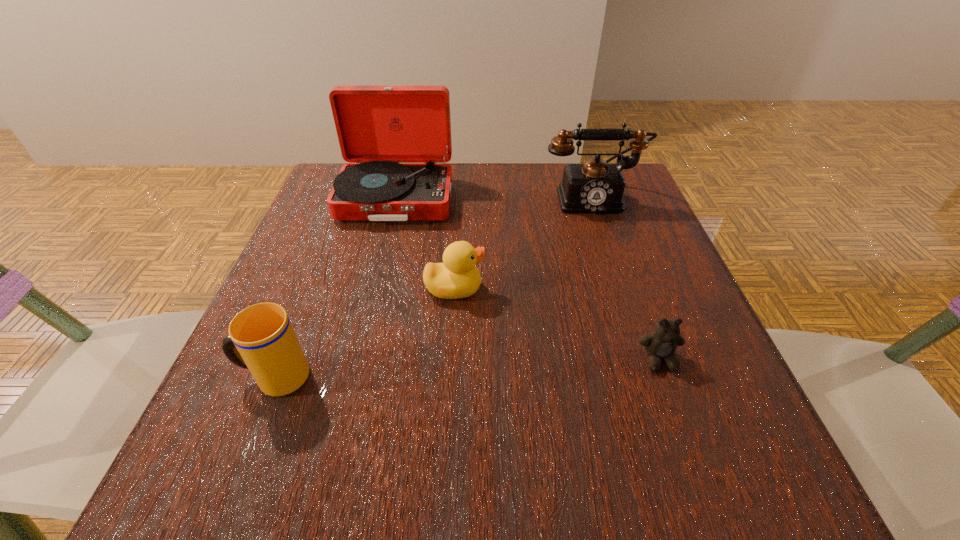
Find the location of a particular element. The height and width of the screenshot is (540, 960). empty space between the fourth shortest object and the third farthest object is located at coordinates (523, 244).

The width and height of the screenshot is (960, 540). What are the coordinates of `free space that is in between the tallest object and the telephone` in the screenshot? It's located at (493, 199).

This screenshot has width=960, height=540. What are the coordinates of `the closest object to the third nearest object` in the screenshot? It's located at (397, 139).

Identify which object is located as the third nearest to the second shortest object. Please provide its 2D coordinates. Your answer should be formatted as a tuple, i.e. [(x, y)], where the tuple contains the x and y coordinates of a point satisfying the conditions above.

[(593, 187)]

This screenshot has height=540, width=960. Find the location of `free spot that satisfies the following two spatial constraints: 1. on the front of the telephone at the rotary dial; 2. at the beak of the third farthest object`. free spot that satisfies the following two spatial constraints: 1. on the front of the telephone at the rotary dial; 2. at the beak of the third farthest object is located at coordinates (622, 288).